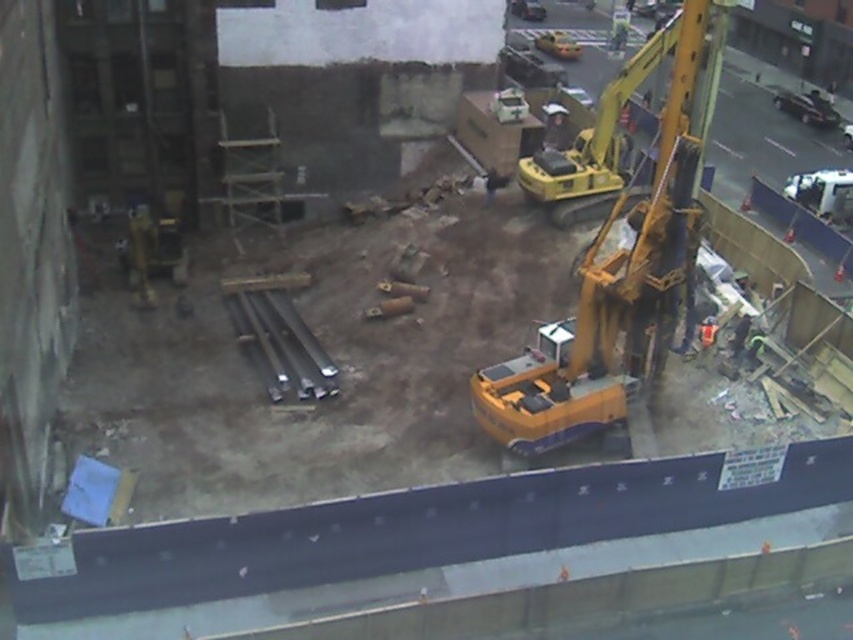
You are a construction worker standing at the edge of the construction site. You need to locate the yellow metallic excavator at center. According to the coordinates provided, where exactly is it located?

The yellow metallic excavator at center is located at coordinates point (x=619, y=259).

Based on the photo, you are an engineer overseeing the construction site. You need to ensure safety by placing a safety net between the yellow metallic excavator at center and the yellow hard hat at center. Which object should the safety net be placed closer to, the one that is higher up?

The yellow hard hat at center is higher up than the yellow metallic excavator at center, so the safety net should be placed closer to the yellow hard hat at center.

You are a construction worker standing at the edge of the construction site. You need to move a heavy tool from the yellow metallic excavator at center to the yellow hard hat at center. Given that your carrying capacity is limited to 10 meters, can you safely transport the tool without assistance?

The distance between the yellow metallic excavator at center and the yellow hard hat at center is 10.72 meters, which exceeds your carrying capacity of 10 meters. Therefore, you cannot safely transport the tool without assistance.